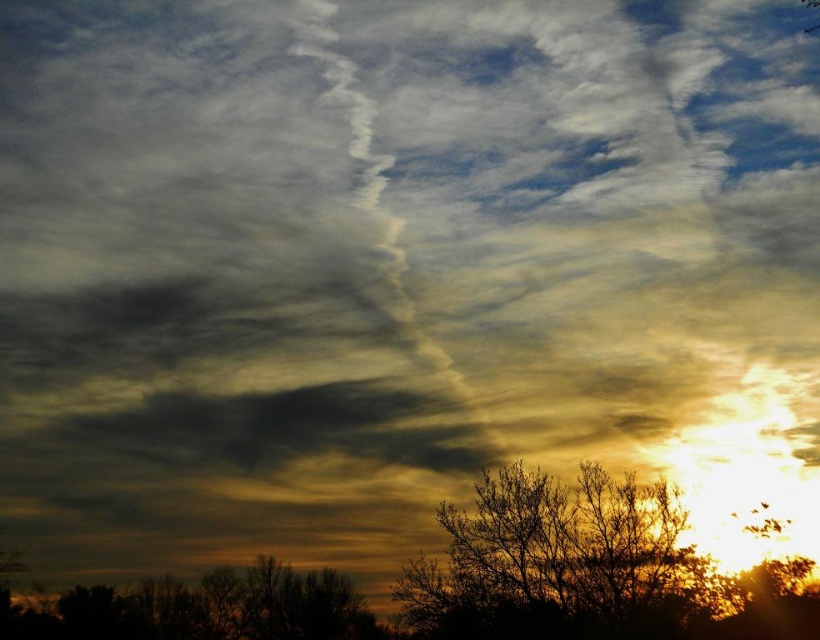
You are an artist trying to paint the scene. You want to make sure the silhouette bark tree at lower right and the brown matte tree at lower left are proportionally accurate. Which tree should you draw taller in your painting?

The silhouette bark tree at lower right should be drawn taller because it is much taller than the brown matte tree at lower left according to the description.